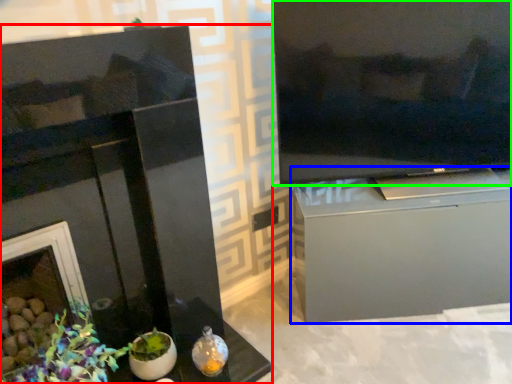
Question: Based on their relative distances, which object is nearer to fireplace (highlighted by a red box)? Choose from cabinetry (highlighted by a blue box) and television (highlighted by a green box).

Choices:
 (A) cabinetry
 (B) television

Answer: (A)